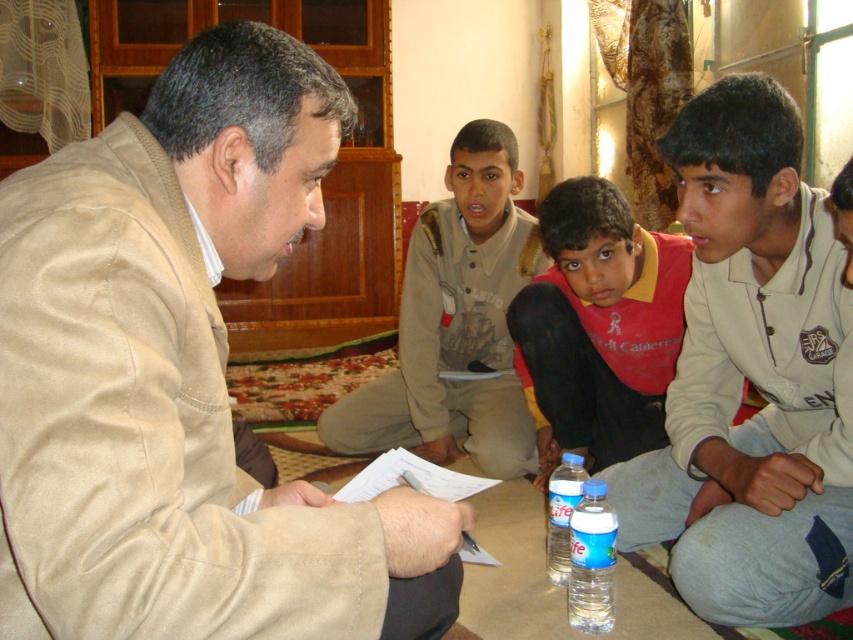
Question: From the image, what is the correct spatial relationship of red/yellow shirt at center in relation to clear plastic bottle at lower center?

Choices:
 (A) left
 (B) right

Answer: (B)

Question: Which point appears farthest from the camera in this image?

Choices:
 (A) (430, 246)
 (B) (567, 576)
 (C) (100, 333)
 (D) (643, 262)

Answer: (A)

Question: Which object appears farthest from the camera in this image?

Choices:
 (A) beige suede jacket at left
 (B) red/yellow shirt at center
 (C) clear plastic bottle at lower center

Answer: (B)

Question: Is khaki cotton shirt at center smaller than clear plastic water bottle at lower center?

Choices:
 (A) no
 (B) yes

Answer: (A)

Question: Does beige suede jacket at left have a smaller size compared to clear plastic water bottle at lower center?

Choices:
 (A) yes
 (B) no

Answer: (B)

Question: Which object appears farthest from the camera in this image?

Choices:
 (A) clear plastic water bottle at lower center
 (B) beige suede jacket at left
 (C) clear plastic bottle at lower center
 (D) red/yellow shirt at center

Answer: (D)